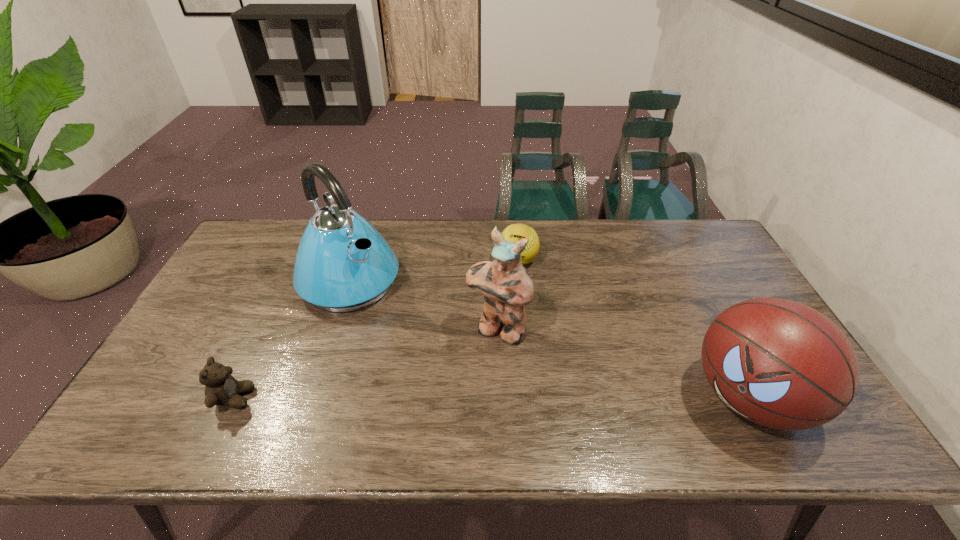
Find the location of a particular element. This screenshot has width=960, height=540. teddy bear is located at coordinates (221, 389).

What are the coordinates of `the third shortest object` in the screenshot? It's located at (781, 364).

Find the location of a particular element. The height and width of the screenshot is (540, 960). basketball is located at coordinates (781, 364).

Identify the location of softball. The height and width of the screenshot is (540, 960). point(515,232).

This screenshot has height=540, width=960. What are the coordinates of `the fourth shortest object` in the screenshot? It's located at (507, 287).

This screenshot has width=960, height=540. I want to click on kettle, so click(342, 264).

Image resolution: width=960 pixels, height=540 pixels. In order to click on vacant space located 0.350m on the face of the teddy bear in this screenshot , I will do `click(398, 398)`.

Find the location of `free point located on the back of the rightmost object`. free point located on the back of the rightmost object is located at coordinates (683, 269).

Find the location of a particular element. free space located 0.310m on the logo side of the softball is located at coordinates click(488, 347).

Where is `free spot located 0.270m on the logo side of the softball`? free spot located 0.270m on the logo side of the softball is located at coordinates (492, 336).